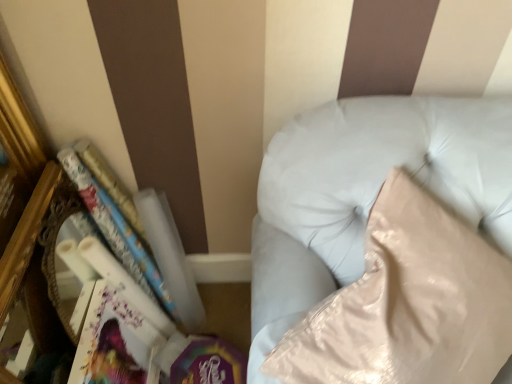
Question: From the image's perspective, does white glossy book at left appear higher than matte white paperback book at lower left?

Choices:
 (A) no
 (B) yes

Answer: (B)

Question: Is white glossy book at left at the right side of matte white paperback book at lower left?

Choices:
 (A) no
 (B) yes

Answer: (B)

Question: Is matte white paperback book at lower left located within white glossy book at left?

Choices:
 (A) yes
 (B) no

Answer: (B)

Question: Is white glossy book at left thinner than matte white paperback book at lower left?

Choices:
 (A) no
 (B) yes

Answer: (A)

Question: Can you confirm if white glossy book at left is taller than matte white paperback book at lower left?

Choices:
 (A) no
 (B) yes

Answer: (B)

Question: Is white glossy book at left aimed at matte white paperback book at lower left?

Choices:
 (A) yes
 (B) no

Answer: (B)

Question: From a real-world perspective, is white glossy book at left beneath white leather couch at upper right?

Choices:
 (A) no
 (B) yes

Answer: (B)

Question: Is white glossy book at left placed right next to white leather couch at upper right?

Choices:
 (A) yes
 (B) no

Answer: (B)

Question: Does white glossy book at left have a lesser width compared to white leather couch at upper right?

Choices:
 (A) no
 (B) yes

Answer: (B)

Question: From a real-world perspective, is white glossy book at left on white leather couch at upper right?

Choices:
 (A) no
 (B) yes

Answer: (A)

Question: Does white glossy book at left have a smaller size compared to white leather couch at upper right?

Choices:
 (A) yes
 (B) no

Answer: (A)

Question: Does white glossy book at left appear on the right side of white leather couch at upper right?

Choices:
 (A) no
 (B) yes

Answer: (A)

Question: Is matte white paperback book at lower left not inside white glossy book at left?

Choices:
 (A) no
 (B) yes

Answer: (B)